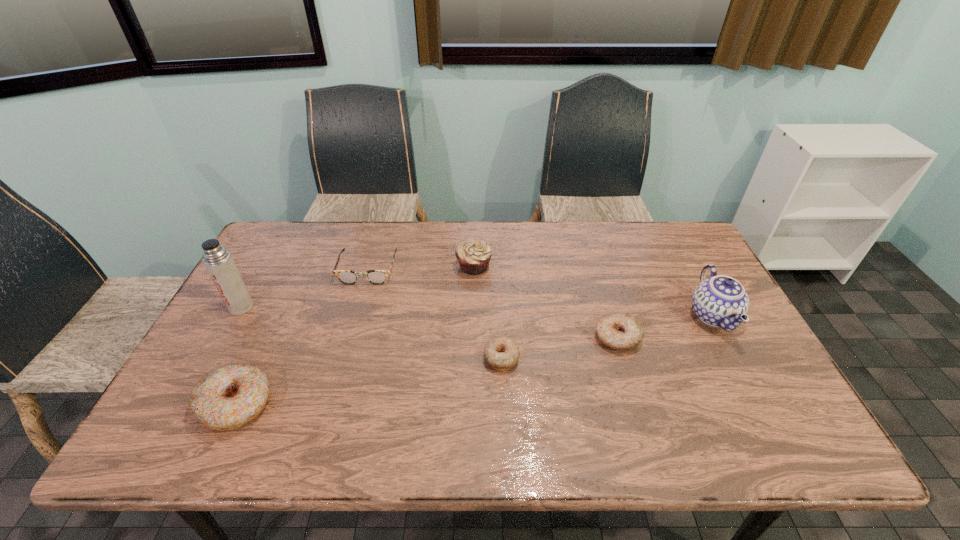
Where is `free space at the far left corner`? free space at the far left corner is located at coordinates 310,250.

The height and width of the screenshot is (540, 960). I want to click on vacant space at the far right corner of the desktop, so click(666, 233).

Locate an element on the screen. The width and height of the screenshot is (960, 540). vacant space that's between the third object from left to right and the sixth shortest object is located at coordinates (540, 293).

Locate an element on the screen. vacant area that lies between the leftmost doughnut and the tallest object is located at coordinates (238, 356).

You are a GUI agent. You are given a task and a screenshot of the screen. Output one action in this format:
    pyautogui.click(x=<x>, y=<y>)
    Task: Click on the free space that is in between the second shortest doughnut and the tallest object
    The image size is (960, 540).
    Given the screenshot: What is the action you would take?
    pyautogui.click(x=429, y=322)

Find the location of a particular element. This screenshot has width=960, height=540. free spot between the third object from left to right and the thermos bottle is located at coordinates (304, 288).

Find the location of a particular element. Image resolution: width=960 pixels, height=540 pixels. free space that is in between the tallest object and the second shortest doughnut is located at coordinates (429, 322).

You are a GUI agent. You are given a task and a screenshot of the screen. Output one action in this format:
    pyautogui.click(x=<x>, y=<y>)
    Task: Click on the unoccupied area between the tallest object and the fourth shortest object
    This screenshot has height=540, width=960.
    Given the screenshot: What is the action you would take?
    pyautogui.click(x=238, y=356)

Locate an element on the screen. vacant space that is in between the fifth shortest object and the leftmost doughnut is located at coordinates (354, 335).

Identify the location of vacant point located between the second object from right to left and the chinaware. (665, 327).